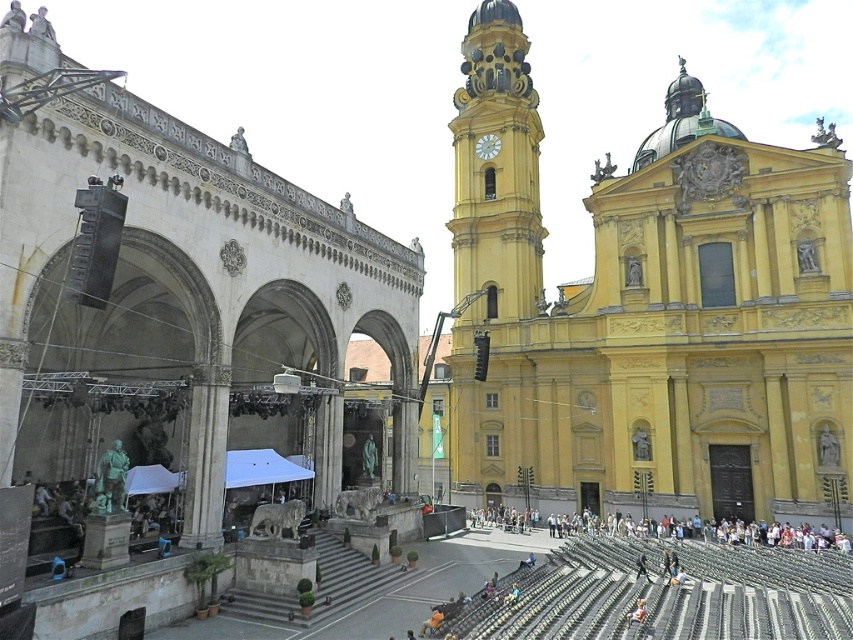
Between point (520, 93) and point (500, 145), which one is positioned in front?

Positioned in front is point (500, 145).

This screenshot has width=853, height=640. In order to click on yellow matte clock tower at upper center in this screenshot , I will do [x=496, y=172].

Who is taller, yellow matte clock tower at upper center or white fabric crowd at lower center?

With more height is yellow matte clock tower at upper center.

Is yellow matte clock tower at upper center closer to the viewer compared to white fabric crowd at lower center?

That is False.

Between point (459, 205) and point (469, 525), which one is positioned behind?

Point (459, 205)

Identify the location of yellow matte clock tower at upper center. The height and width of the screenshot is (640, 853). (496, 172).

Does yellow stone church at center have a smaller size compared to white marble clock at upper center?

No, yellow stone church at center is not smaller than white marble clock at upper center.

Is point (805, 198) closer to camera compared to point (495, 140)?

Yes, point (805, 198) is in front of point (495, 140).

Image resolution: width=853 pixels, height=640 pixels. Find the location of `yellow stone church at center`. yellow stone church at center is located at coordinates (650, 314).